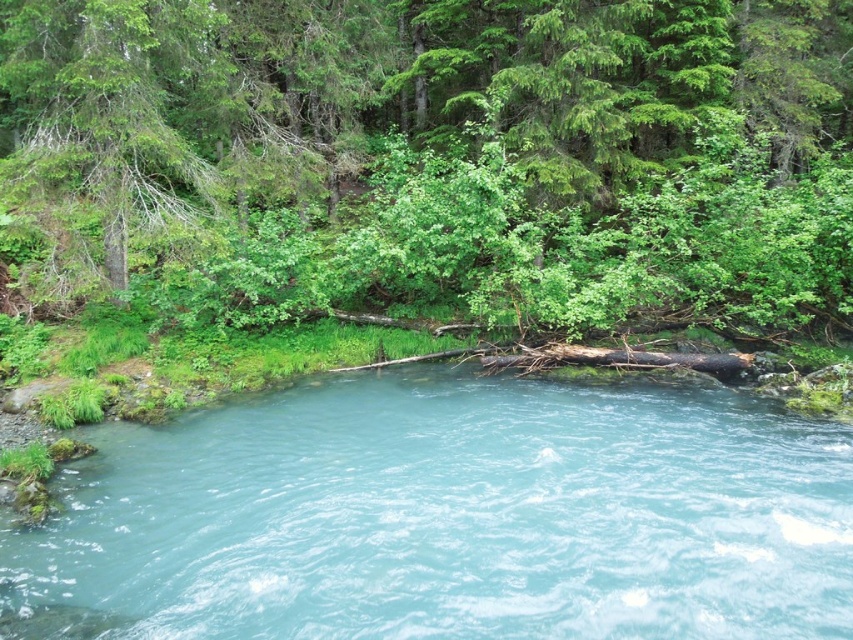
Is green leafy tree at upper center above clear blue water at center?

Yes, green leafy tree at upper center is above clear blue water at center.

Where is `green leafy tree at upper center`? green leafy tree at upper center is located at coordinates (439, 154).

The height and width of the screenshot is (640, 853). I want to click on green leafy tree at upper center, so click(x=439, y=154).

Is point (461, 35) behind point (167, 212)?

That is True.

Measure the distance between green leafy tree at upper center and green leafy tree at upper left.

green leafy tree at upper center is 7.41 meters from green leafy tree at upper left.

Where is `green leafy tree at upper center`? The width and height of the screenshot is (853, 640). green leafy tree at upper center is located at coordinates 439,154.

Can you confirm if clear blue water at center is positioned above green leafy tree at upper left?

No, clear blue water at center is not above green leafy tree at upper left.

Is clear blue water at center smaller than green leafy tree at upper left?

Actually, clear blue water at center might be larger than green leafy tree at upper left.

Is point (125, 572) positioned after point (22, 20)?

No, it is not.

Where is `clear blue water at center`? The image size is (853, 640). clear blue water at center is located at coordinates (447, 516).